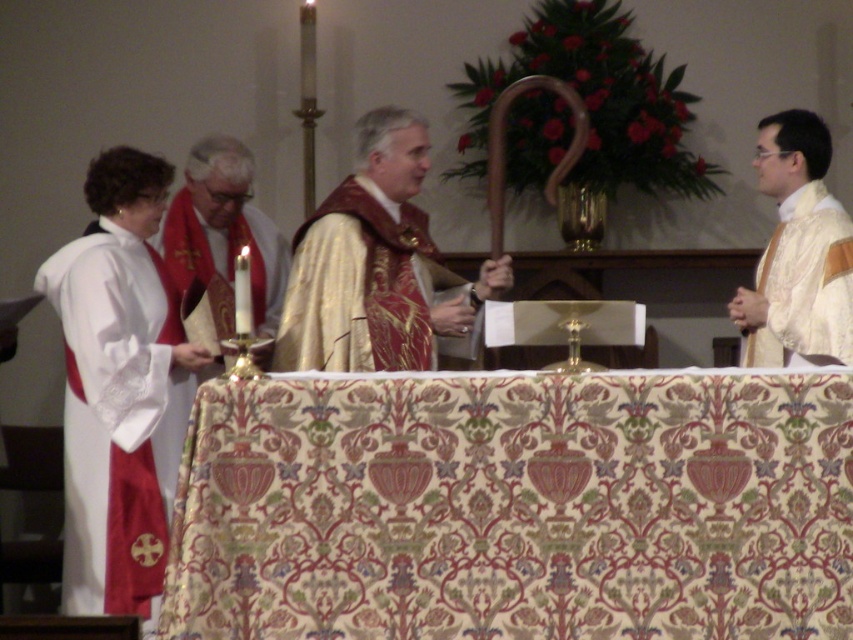
Question: Does white satin robe at left have a larger size compared to white satin robe at right?

Choices:
 (A) no
 (B) yes

Answer: (B)

Question: Is the position of white satin robe at left more distant than that of gold embroidered robe at center?

Choices:
 (A) no
 (B) yes

Answer: (A)

Question: Which object is the closest to the gold embroidered robe at center?

Choices:
 (A) white satin robe at right
 (B) white satin robe at left

Answer: (B)

Question: From the image, what is the correct spatial relationship of gold embroidered robe at center in relation to white satin robe at right?

Choices:
 (A) below
 (B) above

Answer: (A)

Question: Which is nearer to the white satin robe at left?

Choices:
 (A) white satin robe at right
 (B) gold embroidered robe at center

Answer: (B)

Question: Which point is closer to the camera taking this photo?

Choices:
 (A) (746, 356)
 (B) (126, 538)

Answer: (B)